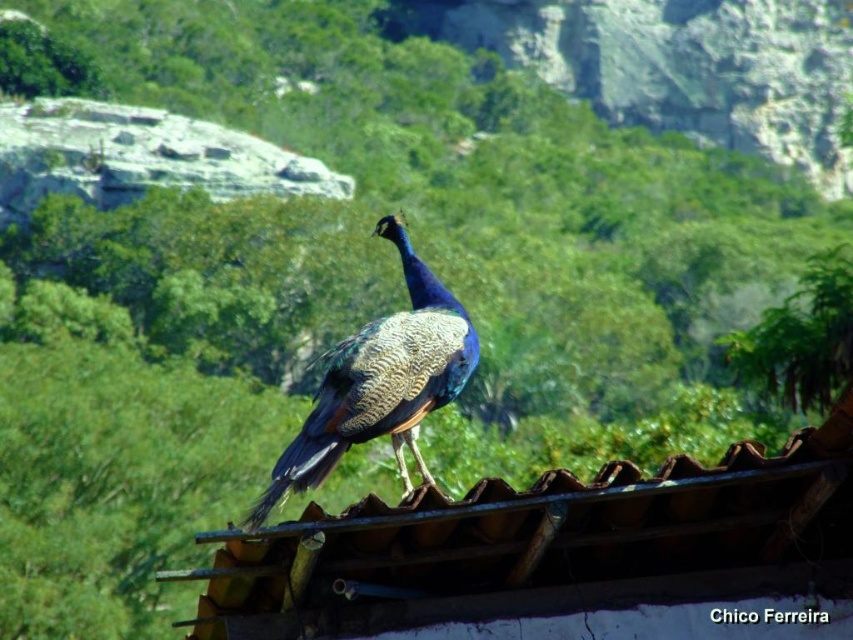
Question: Which of the following is the farthest from the observer?

Choices:
 (A) (556, 618)
 (B) (375, 353)

Answer: (B)

Question: Can you confirm if brown corrugated tile roof at center is positioned above shiny blue peacock at center?

Choices:
 (A) no
 (B) yes

Answer: (A)

Question: Can you confirm if brown corrugated tile roof at center is positioned to the right of shiny blue peacock at center?

Choices:
 (A) no
 (B) yes

Answer: (B)

Question: Is brown corrugated tile roof at center below shiny blue peacock at center?

Choices:
 (A) yes
 (B) no

Answer: (A)